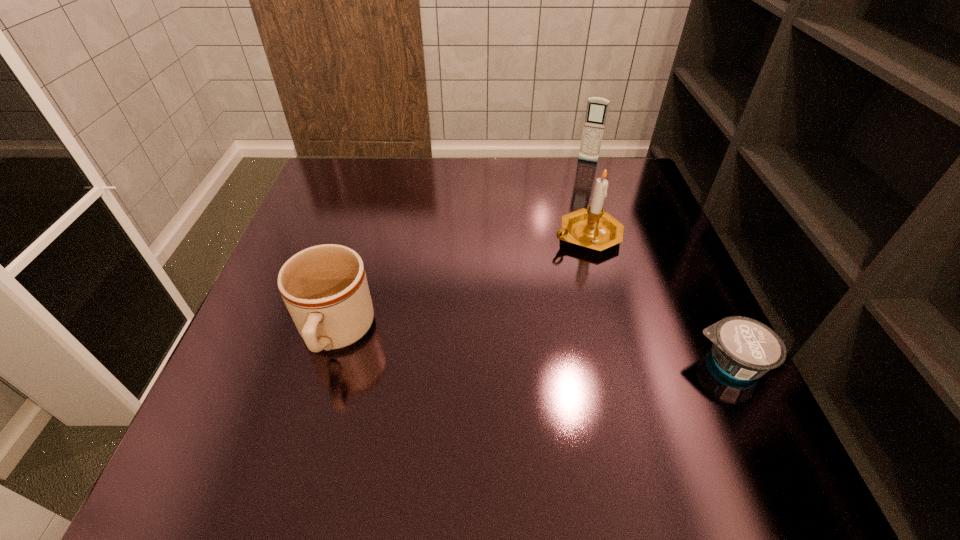
Where is `free spot between the cellular telephone and the candle holder`? Image resolution: width=960 pixels, height=540 pixels. free spot between the cellular telephone and the candle holder is located at coordinates click(x=588, y=198).

Image resolution: width=960 pixels, height=540 pixels. What are the coordinates of `empty space that is in between the third nearest object and the farthest object` in the screenshot? It's located at (588, 198).

Find the location of a particular element. This screenshot has width=960, height=540. vacant area between the shortest object and the candle holder is located at coordinates (659, 299).

The height and width of the screenshot is (540, 960). In order to click on free spot between the third tallest object and the rightmost object in this screenshot , I will do `click(533, 349)`.

Find the location of a particular element. The width and height of the screenshot is (960, 540). free space between the cellular telephone and the candle holder is located at coordinates (588, 198).

You are a GUI agent. You are given a task and a screenshot of the screen. Output one action in this format:
    pyautogui.click(x=<x>, y=<y>)
    Task: Click on the empty space that is in between the rightmost object and the farthest object
    The height and width of the screenshot is (540, 960).
    Given the screenshot: What is the action you would take?
    pyautogui.click(x=659, y=262)

In order to click on empty space between the farthest object and the leftmost object in this screenshot , I will do `click(462, 248)`.

This screenshot has width=960, height=540. Find the location of `free space between the yogurt and the leftmost object`. free space between the yogurt and the leftmost object is located at coordinates (533, 349).

Locate an element on the screen. blank region between the yogurt and the farthest object is located at coordinates (659, 262).

Where is `empty location between the mug and the shortest object`? Image resolution: width=960 pixels, height=540 pixels. empty location between the mug and the shortest object is located at coordinates (533, 349).